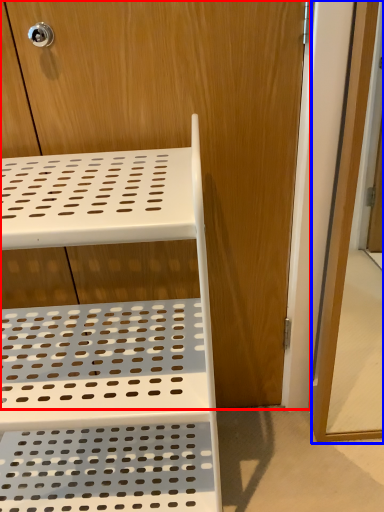
Question: Which point is further to the camera, dresser (highlighted by a red box) or screen door (highlighted by a blue box)?

Choices:
 (A) dresser
 (B) screen door

Answer: (A)